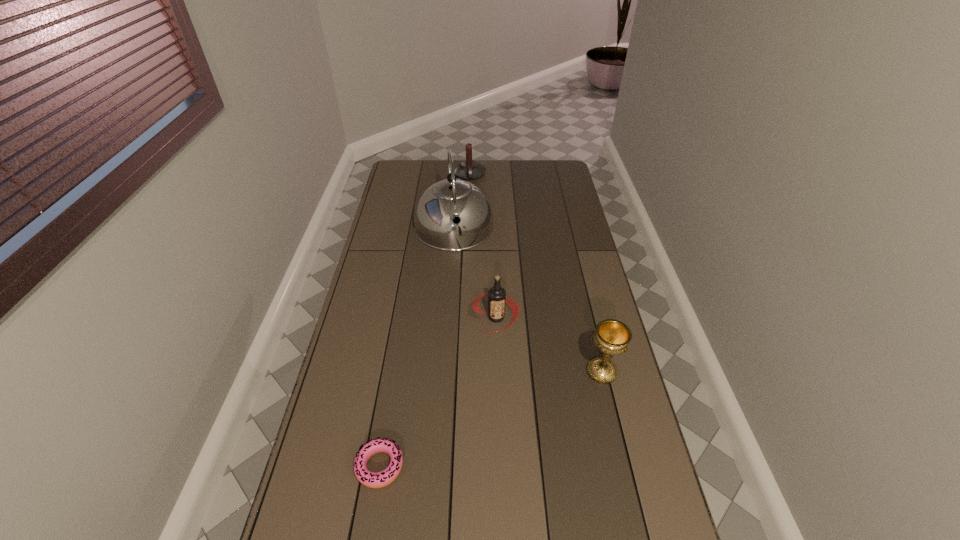
The height and width of the screenshot is (540, 960). I want to click on vacant area that satisfies the following two spatial constraints: 1. on the back side of the nearest object; 2. on the left side of the fourth nearest object, so click(420, 228).

In order to click on free space in the image that satisfies the following two spatial constraints: 1. on the back side of the candle; 2. on the right side of the shortest object in this screenshot , I will do `click(428, 174)`.

Identify the location of free space that satisfies the following two spatial constraints: 1. on the back side of the root beer; 2. on the right side of the nearest object. This screenshot has width=960, height=540. (404, 317).

Identify the location of free location that satisfies the following two spatial constraints: 1. on the front side of the third nearest object; 2. on the right side of the tallest object. (447, 317).